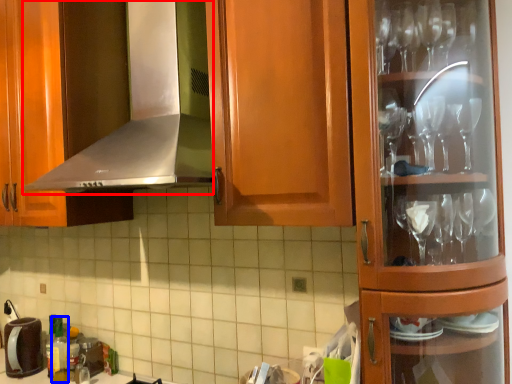
Question: Which object appears closest to the camera in this image, exhaust hood (highlighted by a red box) or bottle (highlighted by a blue box)?

Choices:
 (A) exhaust hood
 (B) bottle

Answer: (A)